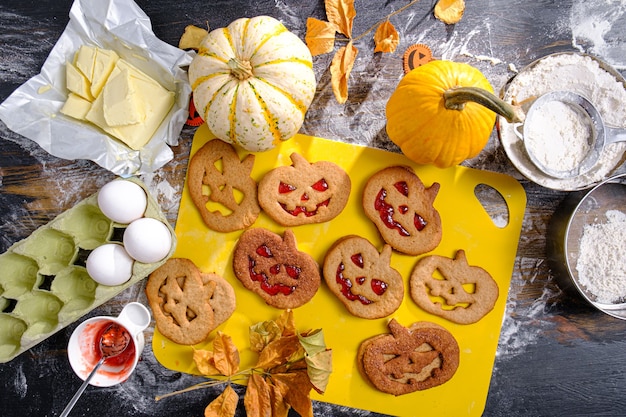
The height and width of the screenshot is (417, 626). Identify the location of yellow cutting board. (479, 367).